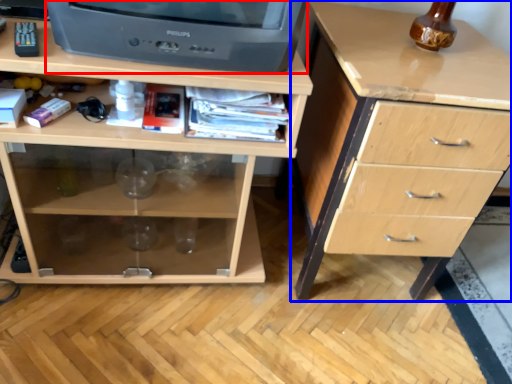
Question: Which object is closer to the camera taking this photo, television (highlighted by a red box) or chest of drawers (highlighted by a blue box)?

Choices:
 (A) television
 (B) chest of drawers

Answer: (A)